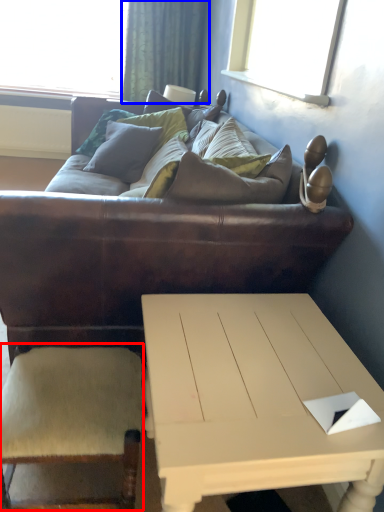
Question: Among these objects, which one is nearest to the camera, armchair (highlighted by a red box) or curtain (highlighted by a blue box)?

Choices:
 (A) armchair
 (B) curtain

Answer: (A)